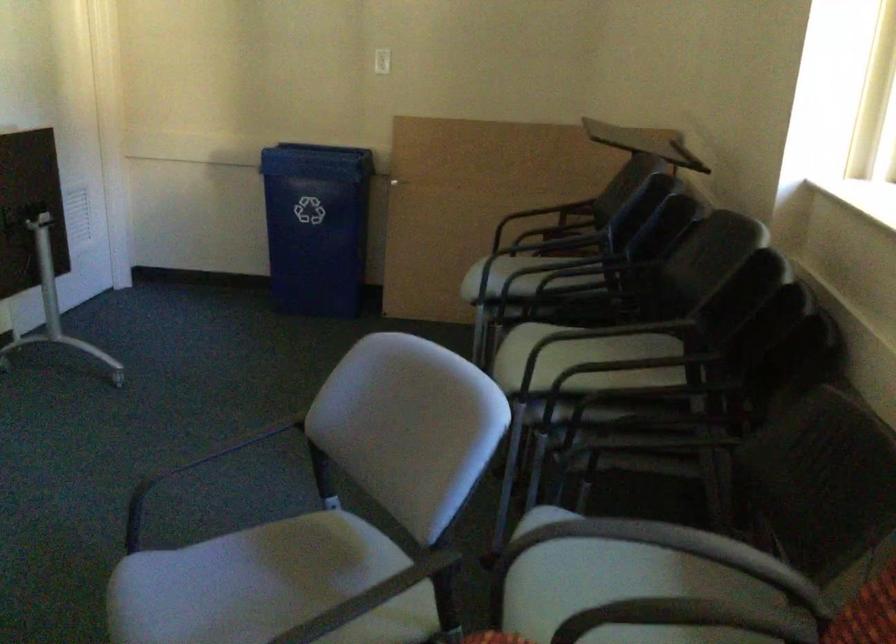
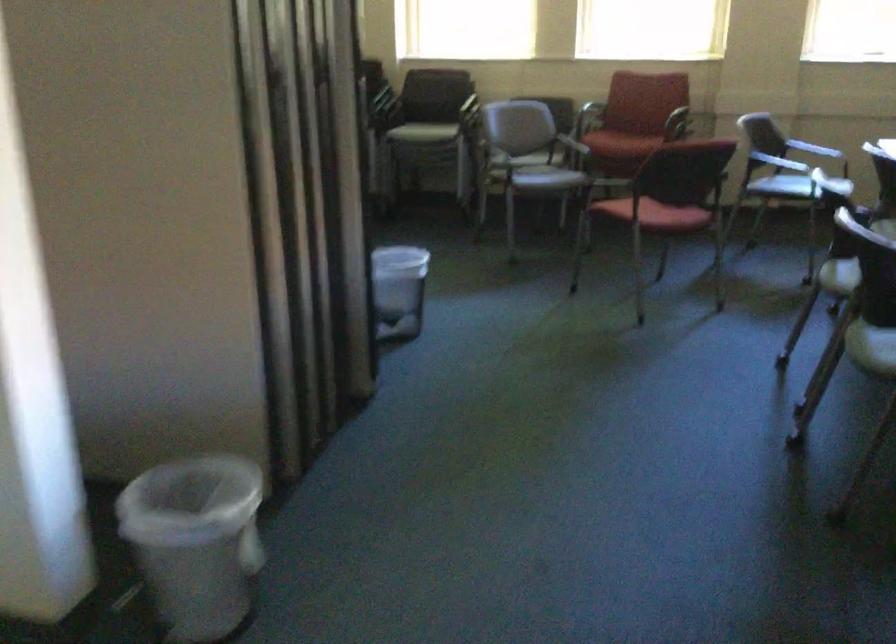
Question: I am providing you with two images of the same scene from different viewpoints. Please identify which objects are invisible in image2.

Choices:
 (A) plastic trash can
 (B) grey chair sitting surface
 (C) chair sitting surface
 (D) ceramic figurine

Answer: (C)